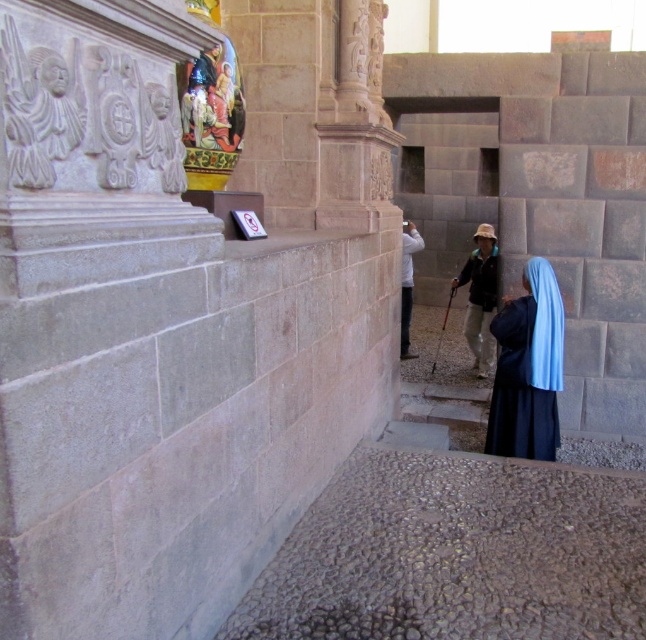
You are an observer standing in the room. You see a blue fabric headscarf at lower right and a black matte robe at center. Which object is closer to you?

The blue fabric headscarf at lower right is closer to you because it is in front of the black matte robe at center.

From the picture: You are an interior designer planning to hang a new artwork between the shiny gold vase at upper center and the white matte jacket at center. Based on their positions, which object should the artwork be placed to the left of?

The artwork should be placed to the left of the white matte jacket at center because the shiny gold vase at upper center is positioned on the left side of the white matte jacket at center.